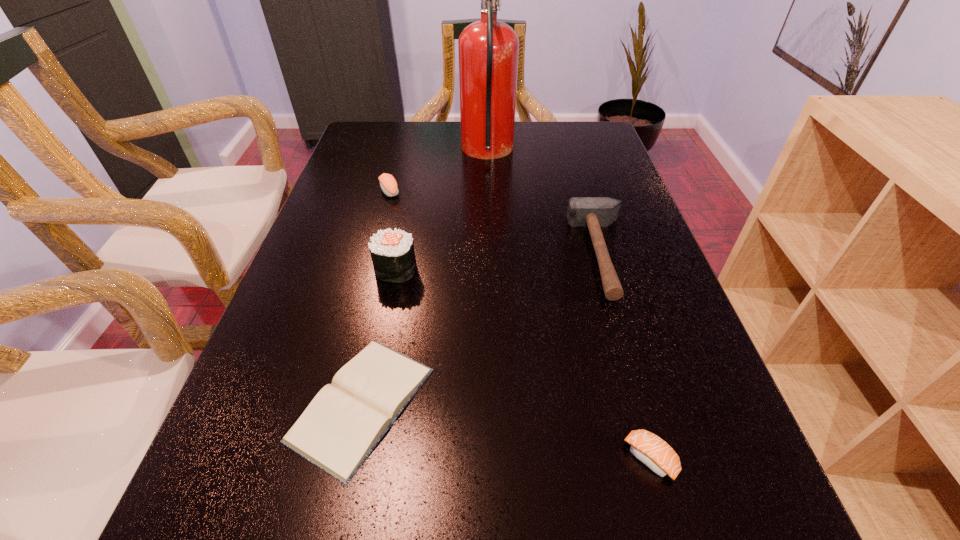
Where is `empty space between the third object from right to left and the shortest object`? empty space between the third object from right to left and the shortest object is located at coordinates (424, 278).

Locate an element on the screen. vacant area between the Bible and the third shortest object is located at coordinates (376, 298).

This screenshot has height=540, width=960. What are the coordinates of `free space between the shortest object and the second tallest sushi` in the screenshot? It's located at (376, 298).

Image resolution: width=960 pixels, height=540 pixels. Identify the location of free space between the shortest sushi and the hammer. (626, 356).

This screenshot has height=540, width=960. Identify the location of free area in between the hammer and the nearest sushi. (626, 356).

At what (x,y) coordinates should I click in order to perform the action: click on vacant space that's between the second nearest sushi and the hammer. Please return your answer as a coordinate pair (x, y). The image size is (960, 540). Looking at the image, I should click on (499, 262).

You are a GUI agent. You are given a task and a screenshot of the screen. Output one action in this format:
    pyautogui.click(x=<x>, y=<y>)
    Task: Click on the empty space that is in between the hammer and the fifth nearest object
    
    Given the screenshot: What is the action you would take?
    pyautogui.click(x=496, y=222)

Locate an element on the screen. This screenshot has width=960, height=540. free space between the second tallest sushi and the Bible is located at coordinates (376, 298).

I want to click on vacant region between the tallest object and the rightmost sushi, so click(x=568, y=306).

Locate which object is the fourth closest to the shortest object. Please provide its 2D coordinates. Your answer should be formatted as a tuple, i.e. [(x, y)], where the tuple contains the x and y coordinates of a point satisfying the conditions above.

[(388, 184)]